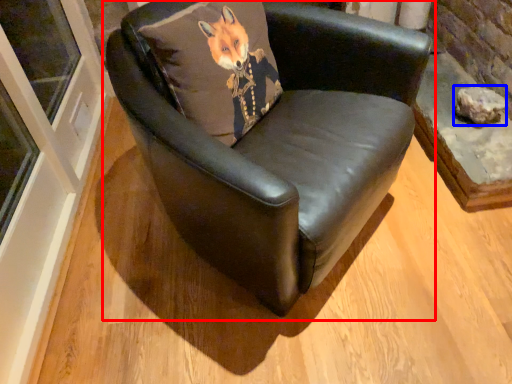
Question: Which object appears farthest to the camera in this image, chair (highlighted by a red box) or stone (highlighted by a blue box)?

Choices:
 (A) chair
 (B) stone

Answer: (B)